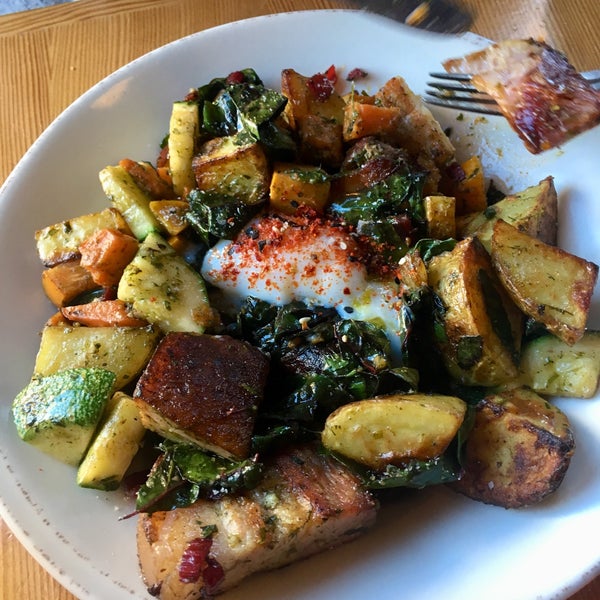
Identify the location of edge of plate. This screenshot has width=600, height=600. (65, 112), (42, 555), (583, 580).